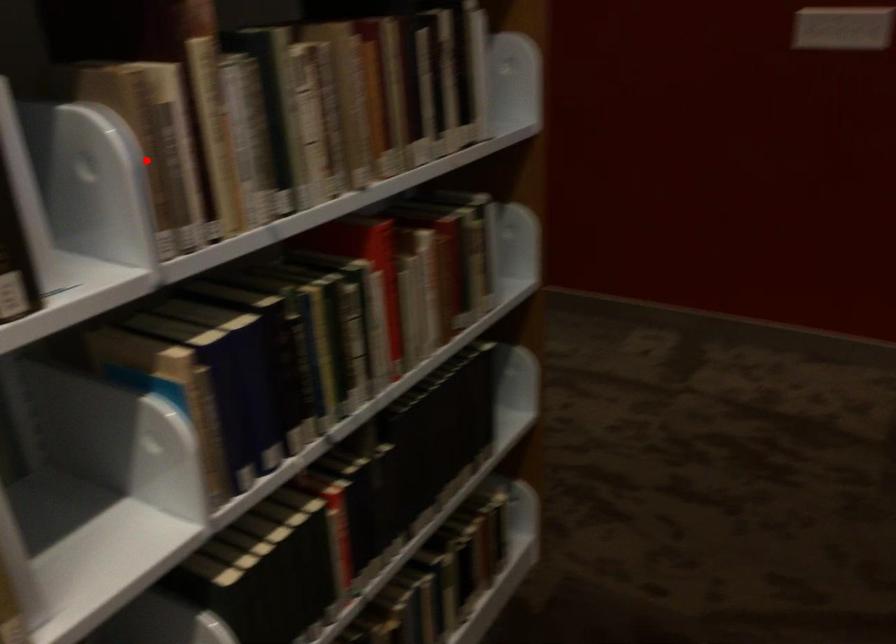
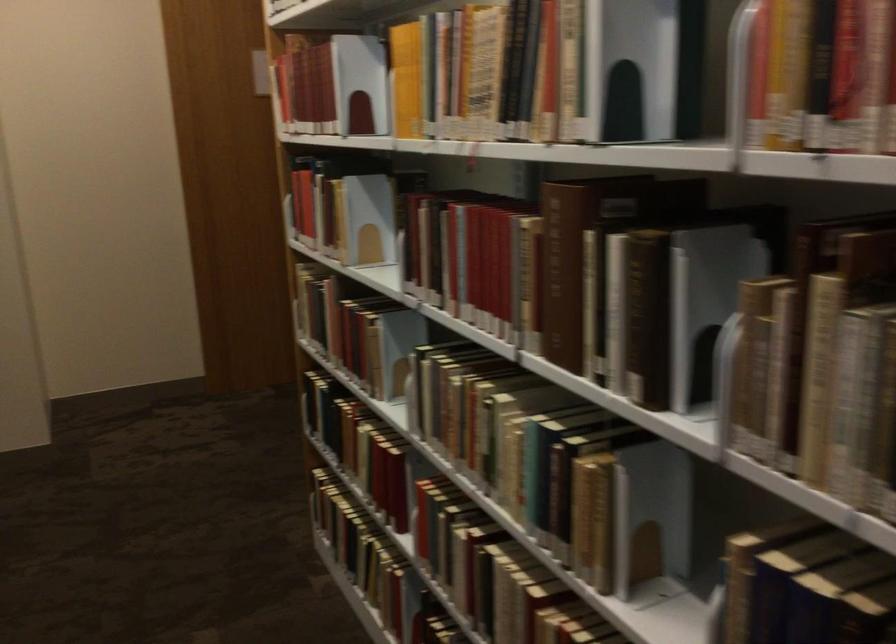
Where in the second image is the point corresponding to the highlighted location from the first image?

(743, 363)